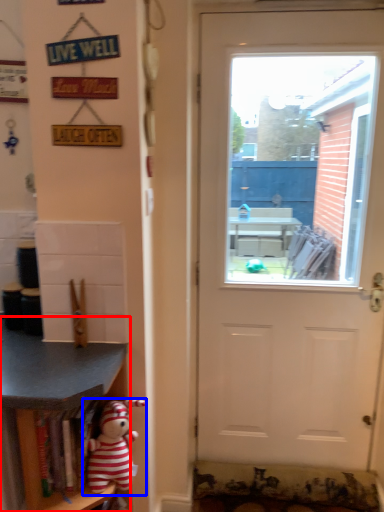
Question: Among these objects, which one is nearest to the camera, shelf (highlighted by a red box) or toy (highlighted by a blue box)?

Choices:
 (A) shelf
 (B) toy

Answer: (A)